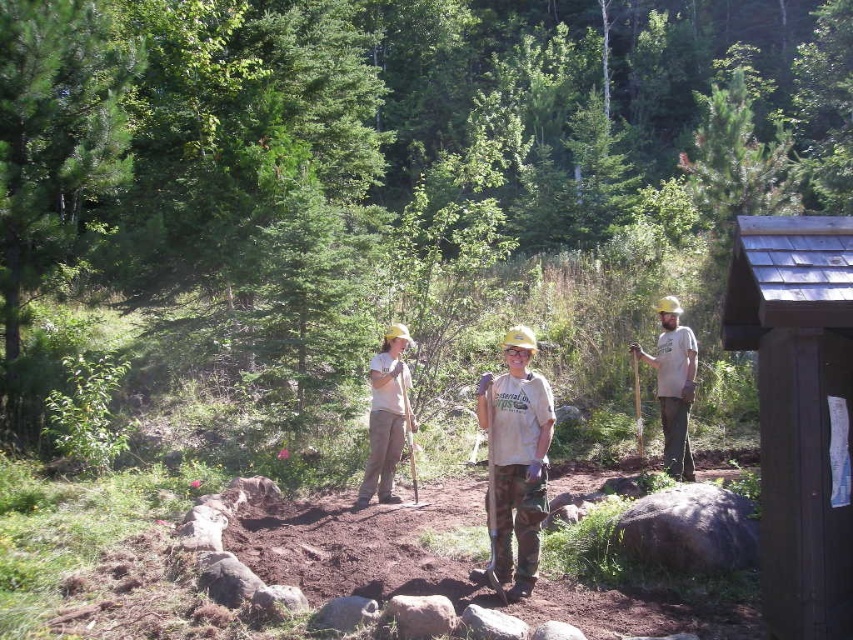
Question: Can you confirm if wooden shingled hut at right is positioned below light brown wood shovel at center?

Choices:
 (A) no
 (B) yes

Answer: (A)

Question: Which of the following is the farthest from the observer?

Choices:
 (A) (770, 396)
 (B) (503, 474)
 (C) (395, 188)
 (D) (671, 346)

Answer: (C)

Question: Does wooden shingled hut at right lie in front of light brown wood shovel at center?

Choices:
 (A) no
 (B) yes

Answer: (B)

Question: Which point appears closest to the camera in this image?

Choices:
 (A) (677, 461)
 (B) (323, 154)
 (C) (514, 396)
 (D) (791, 289)

Answer: (D)

Question: Which point is farther from the camera taking this photo?

Choices:
 (A) (709, 328)
 (B) (833, 541)
 (C) (517, 467)
 (D) (648, 356)

Answer: (A)

Question: Is green leafy forest at center further to camera compared to wooden shingled hut at right?

Choices:
 (A) yes
 (B) no

Answer: (A)